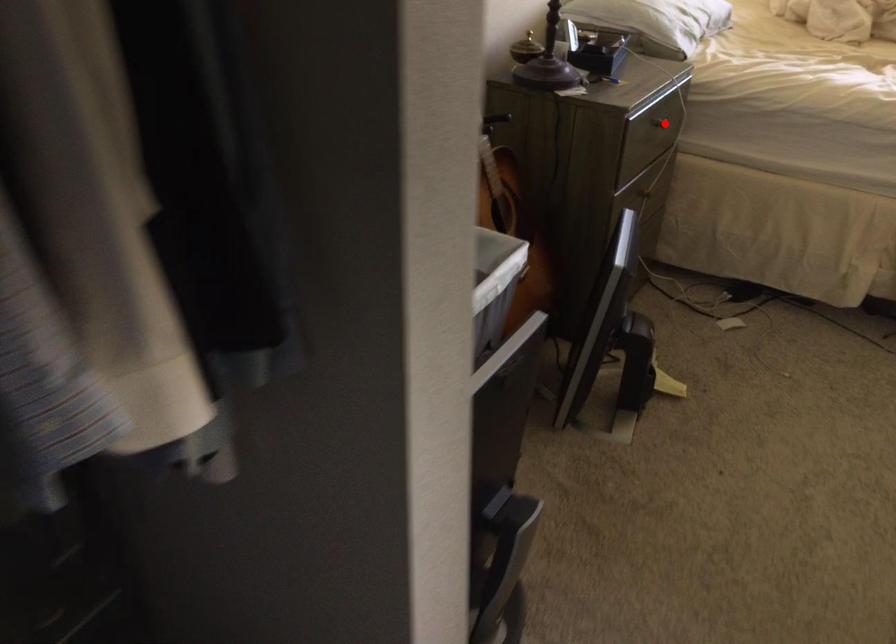
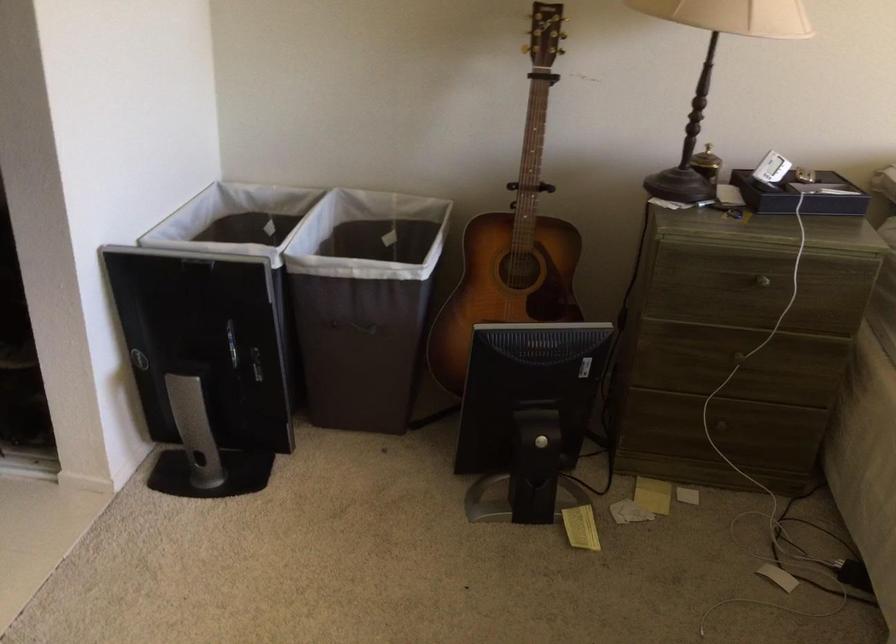
Where in the second image is the point corresponding to the highlighted location from the first image?

(762, 281)